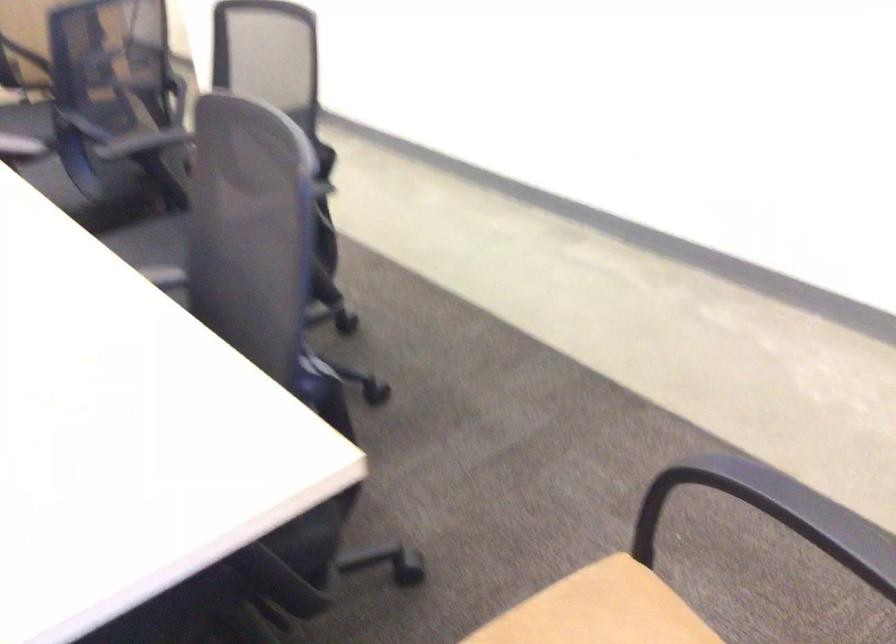
The height and width of the screenshot is (644, 896). What are the coordinates of `black chair sitting surface` in the screenshot? It's located at (195, 379).